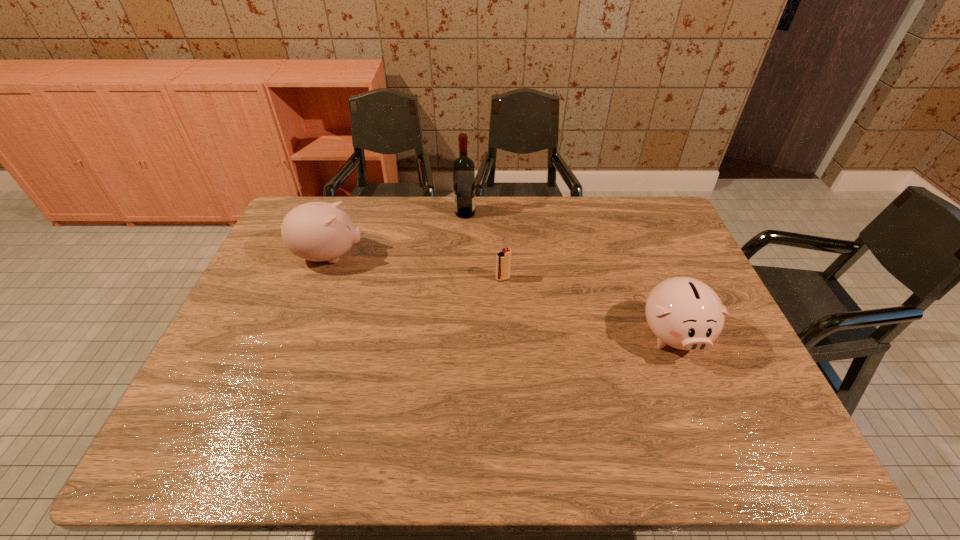
You are a GUI agent. You are given a task and a screenshot of the screen. Output one action in this format:
    pyautogui.click(x=<x>, y=<y>)
    Task: Click on the second object from left to right
    
    Given the screenshot: What is the action you would take?
    pyautogui.click(x=463, y=168)

Where is `alcohol`? This screenshot has height=540, width=960. alcohol is located at coordinates (463, 168).

The width and height of the screenshot is (960, 540). Find the location of `the leftmost object`. the leftmost object is located at coordinates (317, 231).

This screenshot has height=540, width=960. What are the coordinates of `the farther piggy bank` in the screenshot? It's located at (317, 231).

At what (x,y) coordinates should I click in order to perform the action: click on the nearest object. Please return your answer as a coordinate pair (x, y). This screenshot has width=960, height=540. Looking at the image, I should click on (685, 313).

Locate an element on the screen. the nearer piggy bank is located at coordinates (685, 313).

This screenshot has height=540, width=960. I want to click on igniter, so click(503, 259).

This screenshot has width=960, height=540. Identify the location of the third object from left to right. (503, 259).

I want to click on free space located 0.390m on the front and back of the second object from left to right, so (587, 213).

This screenshot has width=960, height=540. I want to click on free spot located at the snout of the farther piggy bank, so click(484, 256).